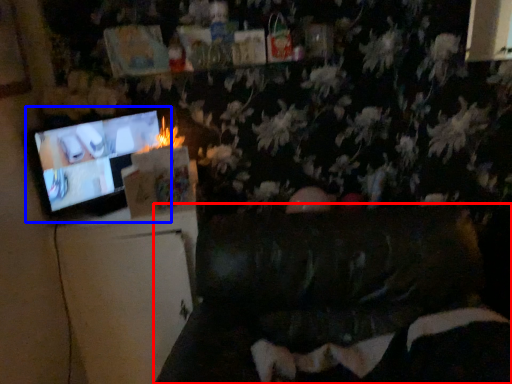
Question: Which point is closer to the camera, furniture (highlighted by a red box) or television (highlighted by a blue box)?

Choices:
 (A) furniture
 (B) television

Answer: (A)